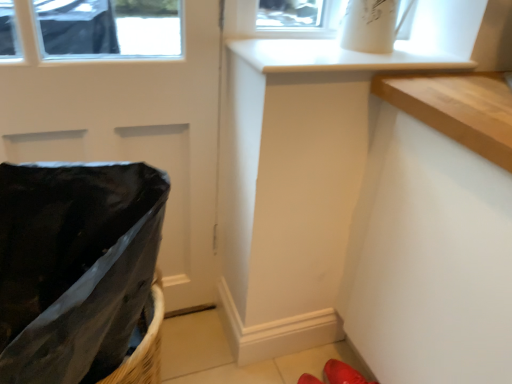
The height and width of the screenshot is (384, 512). Describe the element at coordinates (131, 130) in the screenshot. I see `glossy black door at left` at that location.

Locate an element on the screen. This screenshot has width=512, height=384. glossy black door at left is located at coordinates (131, 130).

Is black plastic laundry basket at left bigger or smaller than red rubber shoes at lower right?

Considering their sizes, black plastic laundry basket at left takes up more space than red rubber shoes at lower right.

How many degrees apart are the facing directions of black plastic laundry basket at left and red rubber shoes at lower right?

The angular difference between black plastic laundry basket at left and red rubber shoes at lower right is 61.8 degrees.

Where is `tile on the right of black plastic laundry basket at left`? The image size is (512, 384). tile on the right of black plastic laundry basket at left is located at coordinates (x=316, y=361).

Considering the relative sizes of black plastic laundry basket at left and red rubber shoes at lower right in the image provided, is black plastic laundry basket at left taller than red rubber shoes at lower right?

Correct, black plastic laundry basket at left is much taller as red rubber shoes at lower right.

From the image's perspective, relative to glossy black door at left, is red rubber shoes at lower right above or below?

red rubber shoes at lower right is situated lower than glossy black door at left in the image.

Is red rubber shoes at lower right to the left of glossy black door at left from the viewer's perspective?

No.

Are red rubber shoes at lower right and glossy black door at left far apart?

No, red rubber shoes at lower right is not far away from glossy black door at left.

Can you confirm if glossy black door at left is wider than red rubber shoes at lower right?

In fact, glossy black door at left might be narrower than red rubber shoes at lower right.

Is glossy black door at left further to camera compared to red rubber shoes at lower right?

No, it is not.

Could you tell me if glossy black door at left is turned towards red rubber shoes at lower right?

No.

Considering the points (151, 123) and (285, 362), which point is behind, point (151, 123) or point (285, 362)?

Point (285, 362)

Is red rubber shoes at lower right positioned with its back to black plastic laundry basket at left?

No, red rubber shoes at lower right's orientation is not away from black plastic laundry basket at left.

Does point (302, 361) come in front of point (0, 226)?

No, it is not.

Is glossy black door at left at the right side of black plastic laundry basket at left?

No, glossy black door at left is not to the right of black plastic laundry basket at left.

From a real-world perspective, who is located higher, glossy black door at left or black plastic laundry basket at left?

In real-world perspective, glossy black door at left is above.

Which is in front, glossy black door at left or black plastic laundry basket at left?

black plastic laundry basket at left is more forward.

In the scene shown: Considering the sizes of objects black plastic laundry basket at left and glossy black door at left in the image provided, who is wider, black plastic laundry basket at left or glossy black door at left?

black plastic laundry basket at left.

Measure the distance from black plastic laundry basket at left to glossy black door at left.

black plastic laundry basket at left is 16.46 inches away from glossy black door at left.

Which is correct: black plastic laundry basket at left is inside glossy black door at left, or outside of it?

black plastic laundry basket at left is not enclosed by glossy black door at left.

From the image's perspective, is black plastic laundry basket at left above glossy black door at left?

No.

This screenshot has width=512, height=384. In order to click on laundry basket in front of the red rubber shoes at lower right in this screenshot , I will do `click(74, 266)`.

Locate an element on the screen. The width and height of the screenshot is (512, 384). tile below the glossy black door at left (from the image's perspective) is located at coordinates (316, 361).

Which object lies further to the anchor point glossy black door at left, black plastic laundry basket at left or red rubber shoes at lower right?

red rubber shoes at lower right is positioned further to the anchor glossy black door at left.

From the image, which object appears to be nearer to black plastic laundry basket at left, glossy black door at left or red rubber shoes at lower right?

Based on the image, glossy black door at left appears to be nearer to black plastic laundry basket at left.

From the image, which object appears to be nearer to red rubber shoes at lower right, black plastic laundry basket at left or glossy black door at left?

glossy black door at left is positioned closer to the anchor red rubber shoes at lower right.

Estimate the real-world distances between objects in this image. Which object is closer to glossy black door at left, red rubber shoes at lower right or black plastic laundry basket at left?

Among the two, black plastic laundry basket at left is located nearer to glossy black door at left.

Looking at the image, which one is located closer to black plastic laundry basket at left, red rubber shoes at lower right or glossy black door at left?

Among the two, glossy black door at left is located nearer to black plastic laundry basket at left.

Looking at the image, which one is located closer to red rubber shoes at lower right, glossy black door at left or black plastic laundry basket at left?

glossy black door at left.

At what (x,y) coordinates should I click in order to perform the action: click on laundry basket between glossy black door at left and red rubber shoes at lower right. Please return your answer as a coordinate pair (x, y). Looking at the image, I should click on (74, 266).